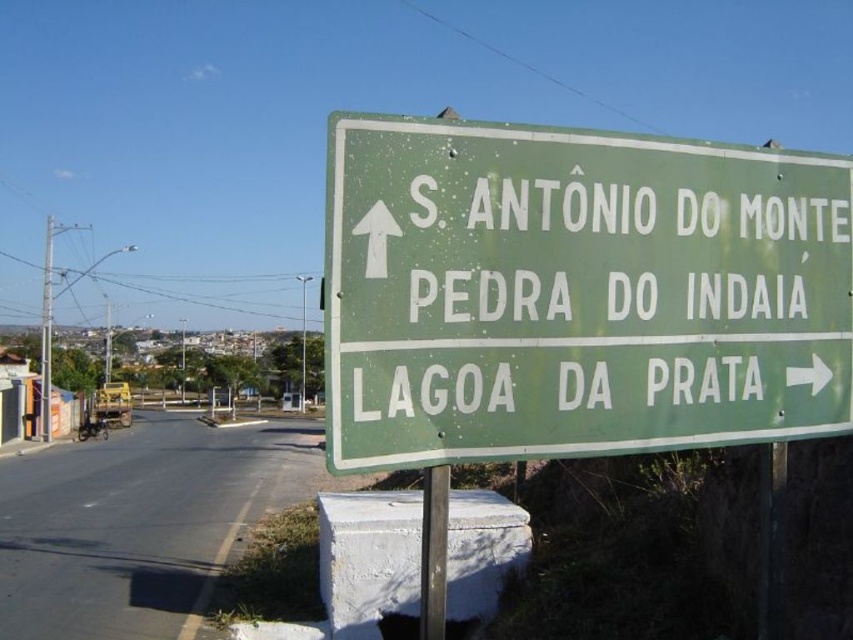
Is point (643, 236) behind point (427, 531)?

Yes, it is behind point (427, 531).

Is the position of green matte sign at upper right less distant than that of metallic pole at center?

Yes, it is.

Which is behind, point (659, 228) or point (422, 600)?

The point (659, 228) is more distant.

Image resolution: width=853 pixels, height=640 pixels. Find the location of `green matte sign at upper right`. green matte sign at upper right is located at coordinates (577, 292).